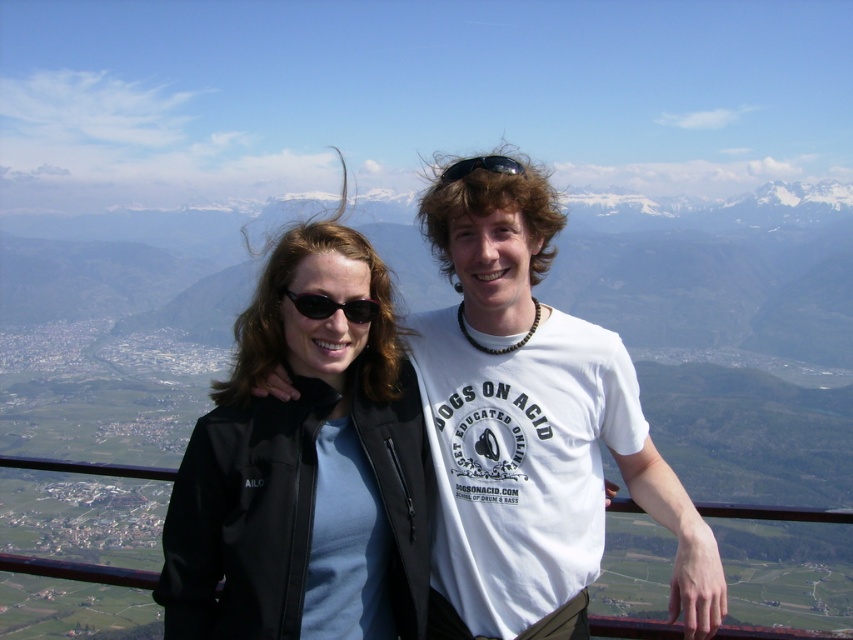
Locate an element on the screen. Image resolution: width=853 pixels, height=640 pixels. black matte jacket at center is located at coordinates [305, 468].

Is black matte jacket at center bigger than black plastic sunglasses at center?

Yes, black matte jacket at center is bigger than black plastic sunglasses at center.

Between point (239, 492) and point (311, 310), which one is positioned in front?

Positioned in front is point (239, 492).

In order to click on black matte jacket at center in this screenshot , I will do `click(305, 468)`.

The height and width of the screenshot is (640, 853). What do you see at coordinates (305, 468) in the screenshot? I see `black matte jacket at center` at bounding box center [305, 468].

Who is more distant from viewer, (347, 365) or (503, 164)?

Point (503, 164)

Between point (196, 509) and point (467, 170), which one is positioned behind?

The point (467, 170) is more distant.

This screenshot has width=853, height=640. Find the location of `black matte jacket at center`. black matte jacket at center is located at coordinates (305, 468).

Does matte black jacket at center appear on the left side of black matte jacket at center?

Incorrect, matte black jacket at center is not on the left side of black matte jacket at center.

Is matte black jacket at center above black matte jacket at center?

Yes, matte black jacket at center is above black matte jacket at center.

I want to click on matte black jacket at center, so click(x=532, y=429).